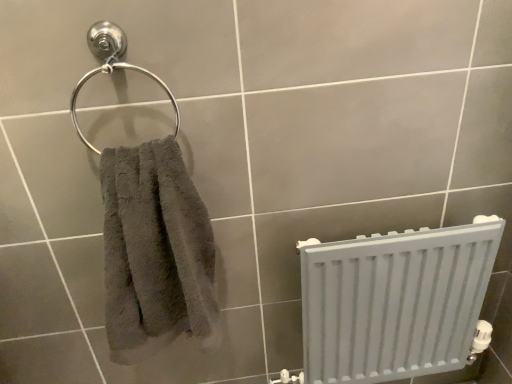
Question: Is point (353, 276) closer or farther from the camera than point (73, 99)?

Choices:
 (A) farther
 (B) closer

Answer: (A)

Question: Based on their sizes in the image, would you say white matte radiator at lower right is bigger or smaller than satin chrome towel ring at upper left?

Choices:
 (A) small
 (B) big

Answer: (B)

Question: Which of these objects is positioned closest to the gray fluffy towel at left?

Choices:
 (A) white matte radiator at lower right
 (B) satin chrome towel ring at upper left

Answer: (B)

Question: Which is farther from the gray fluffy towel at left?

Choices:
 (A) satin chrome towel ring at upper left
 (B) white matte radiator at lower right

Answer: (B)